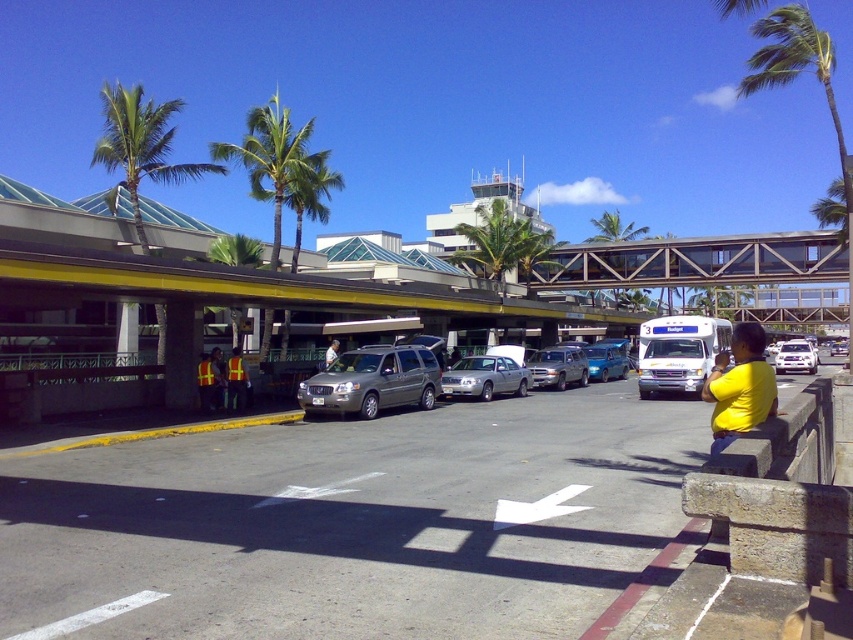
Is point (540, 243) farther from viewer compared to point (473, 378)?

Yes.

Measure the distance between point (473, 253) and camera.

53.59 meters

I want to click on green leafy palm tree at center, so click(502, 243).

In order to click on green leafy palm tree at center in this screenshot , I will do `click(502, 243)`.

Between matte silver minivan at center and green leafy palm tree at upper left, which one has less height?

matte silver minivan at center is shorter.

Does point (370, 364) come farther from viewer compared to point (318, 164)?

No, (370, 364) is in front of (318, 164).

You are a GUI agent. You are given a task and a screenshot of the screen. Output one action in this format:
    pyautogui.click(x=<x>, y=<y>)
    Task: Click on the matte silver minivan at center
    
    Given the screenshot: What is the action you would take?
    pyautogui.click(x=405, y=380)

Identify the location of matte silver minivan at center. The image size is (853, 640). (405, 380).

At what (x,y) coordinates should I click in order to perform the action: click on metallic brown bridge at upper center. Please return your answer as a coordinate pair (x, y). Image resolution: width=853 pixels, height=640 pixels. Looking at the image, I should click on (695, 260).